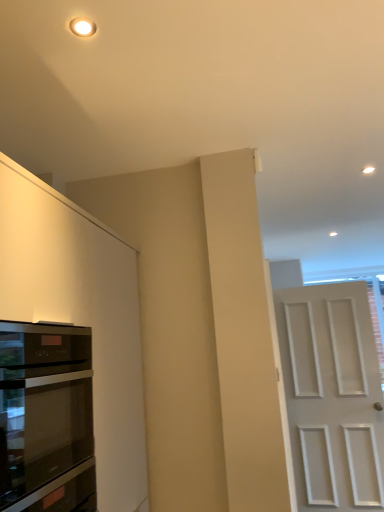
Question: Does white matte door at right have a greater height compared to black glass oven at left?

Choices:
 (A) no
 (B) yes

Answer: (B)

Question: From a real-world perspective, is white matte door at right on top of black glass oven at left?

Choices:
 (A) no
 (B) yes

Answer: (A)

Question: Does white matte door at right touch black glass oven at left?

Choices:
 (A) no
 (B) yes

Answer: (A)

Question: From the image's perspective, is white matte door at right over black glass oven at left?

Choices:
 (A) yes
 (B) no

Answer: (B)

Question: Considering the relative positions of white matte door at right and black glass oven at left in the image provided, is white matte door at right to the right of black glass oven at left from the viewer's perspective?

Choices:
 (A) yes
 (B) no

Answer: (A)

Question: Does white matte door at right have a smaller size compared to black glass oven at left?

Choices:
 (A) no
 (B) yes

Answer: (A)

Question: Can you confirm if black glass oven at left is smaller than white matte door at right?

Choices:
 (A) yes
 (B) no

Answer: (A)

Question: Is black glass oven at left further to camera compared to white matte door at right?

Choices:
 (A) yes
 (B) no

Answer: (B)

Question: Is black glass oven at left not near white matte door at right?

Choices:
 (A) no
 (B) yes

Answer: (B)

Question: Is black glass oven at left placed right next to white matte door at right?

Choices:
 (A) yes
 (B) no

Answer: (B)

Question: Considering the relative positions of black glass oven at left and white matte door at right in the image provided, is black glass oven at left to the left of white matte door at right from the viewer's perspective?

Choices:
 (A) yes
 (B) no

Answer: (A)

Question: Is black glass oven at left shorter than white matte door at right?

Choices:
 (A) yes
 (B) no

Answer: (A)

Question: Does matte white cabinet at left appear on the right side of black glass oven at left?

Choices:
 (A) yes
 (B) no

Answer: (B)